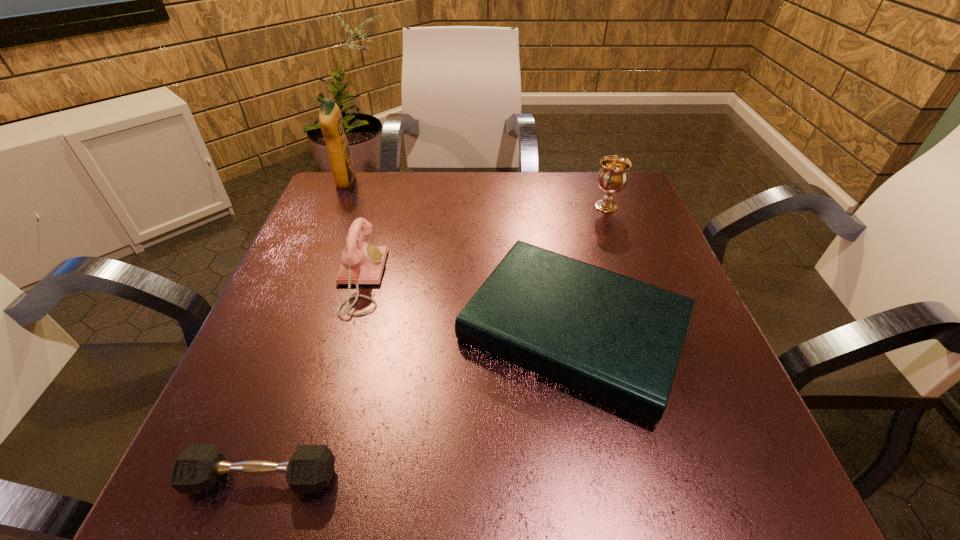
The width and height of the screenshot is (960, 540). What are the coordinates of `vacant space that satisfies the following two spatial constraints: 1. on the label of the tallest object; 2. on the left side of the chalice` in the screenshot? It's located at (336, 206).

You are a GUI agent. You are given a task and a screenshot of the screen. Output one action in this format:
    pyautogui.click(x=<x>, y=<y>)
    Task: Click on the vacant space that satisfies the following two spatial constraints: 1. on the back side of the nearest object; 2. on the label of the detergent
    The height and width of the screenshot is (540, 960).
    Given the screenshot: What is the action you would take?
    pyautogui.click(x=367, y=182)

This screenshot has width=960, height=540. In order to click on vacant region that satisfies the following two spatial constraints: 1. on the label of the farthest object; 2. on the right side of the book in this screenshot , I will do `click(283, 330)`.

You are a GUI agent. You are given a task and a screenshot of the screen. Output one action in this format:
    pyautogui.click(x=<x>, y=<y>)
    Task: Click on the vacant position in the image that satisfies the following two spatial constraints: 1. on the back side of the dumbbell; 2. on the label of the farthest object
    The height and width of the screenshot is (540, 960).
    Given the screenshot: What is the action you would take?
    pyautogui.click(x=367, y=182)

I want to click on vacant space that satisfies the following two spatial constraints: 1. on the front side of the fourth nearest object; 2. on the dial of the telephone, so click(634, 280).

In order to click on vacant area in the image that satisfies the following two spatial constraints: 1. on the back side of the book; 2. on the dial of the telephone in this screenshot , I will do `click(564, 280)`.